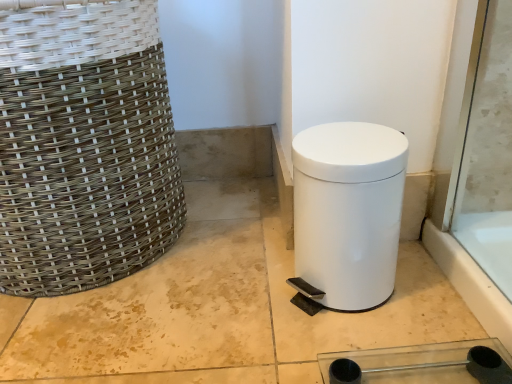
Question: From a real-world perspective, is white glossy trash can at lower right positioned above or below white woven basket at left?

Choices:
 (A) below
 (B) above

Answer: (A)

Question: Is white glossy trash can at lower right inside or outside of white woven basket at left?

Choices:
 (A) outside
 (B) inside

Answer: (A)

Question: Visually, is white glossy trash can at lower right positioned to the left or to the right of white woven basket at left?

Choices:
 (A) left
 (B) right

Answer: (B)

Question: From the image's perspective, is white woven basket at left positioned above or below white glossy trash can at lower right?

Choices:
 (A) above
 (B) below

Answer: (A)

Question: Is white woven basket at left inside or outside of white glossy trash can at lower right?

Choices:
 (A) inside
 (B) outside

Answer: (B)

Question: Considering their positions, is white woven basket at left located in front of or behind white glossy trash can at lower right?

Choices:
 (A) front
 (B) behind

Answer: (A)

Question: Is point coord(52,87) closer or farther from the camera than point coord(354,220)?

Choices:
 (A) farther
 (B) closer

Answer: (A)